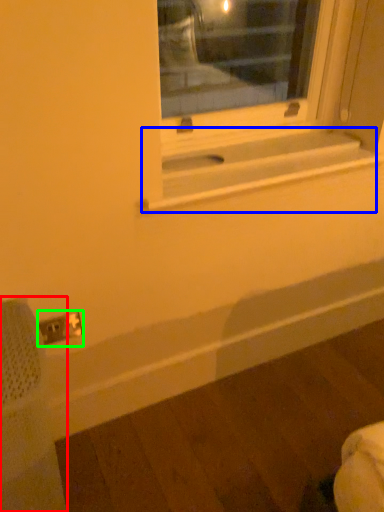
Question: Which is farther away from swivel chair (highlighted by a red box)? window sill (highlighted by a blue box) or electric outlet (highlighted by a green box)?

Choices:
 (A) window sill
 (B) electric outlet

Answer: (A)